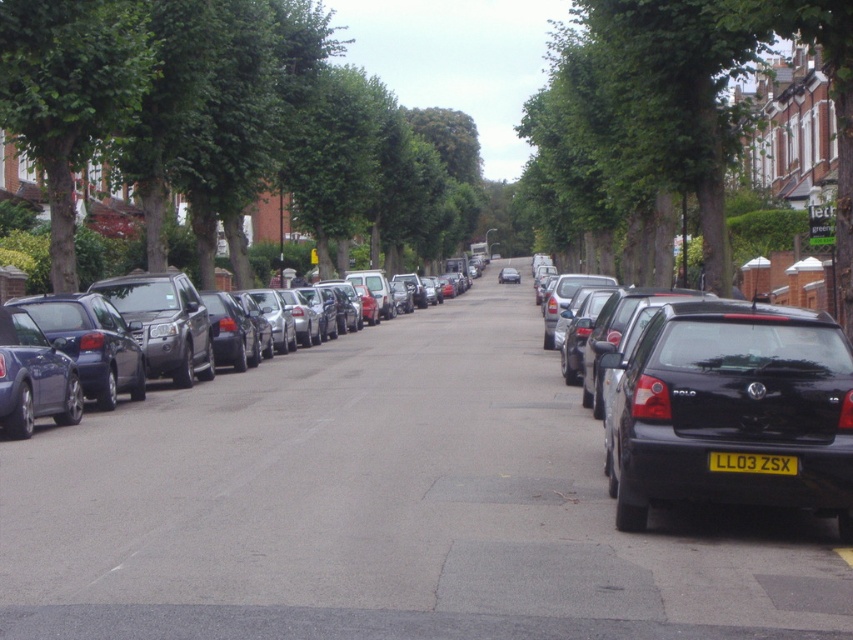
Question: Considering the real-world distances, which object is farthest from the shiny metallic car at center?

Choices:
 (A) black plastic license plate at center
 (B) metallic silver car at center
 (C) green leafy tree at upper left

Answer: (B)

Question: From the image, what is the correct spatial relationship of black glossy car at right in relation to black plastic license plate at center?

Choices:
 (A) above
 (B) below

Answer: (A)

Question: Does green leafy tree at left have a smaller size compared to black plastic license plate at center?

Choices:
 (A) yes
 (B) no

Answer: (B)

Question: Which is farther from the green leafy tree at upper left?

Choices:
 (A) black plastic license plate at center
 (B) metallic silver car at center

Answer: (B)

Question: Which point is farther to the camera?

Choices:
 (A) (157, 337)
 (B) (123, 29)
 (C) (720, 456)
 (D) (830, 388)

Answer: (B)

Question: Can you confirm if black plastic license plate at center is wider than metallic silver car at center?

Choices:
 (A) yes
 (B) no

Answer: (B)